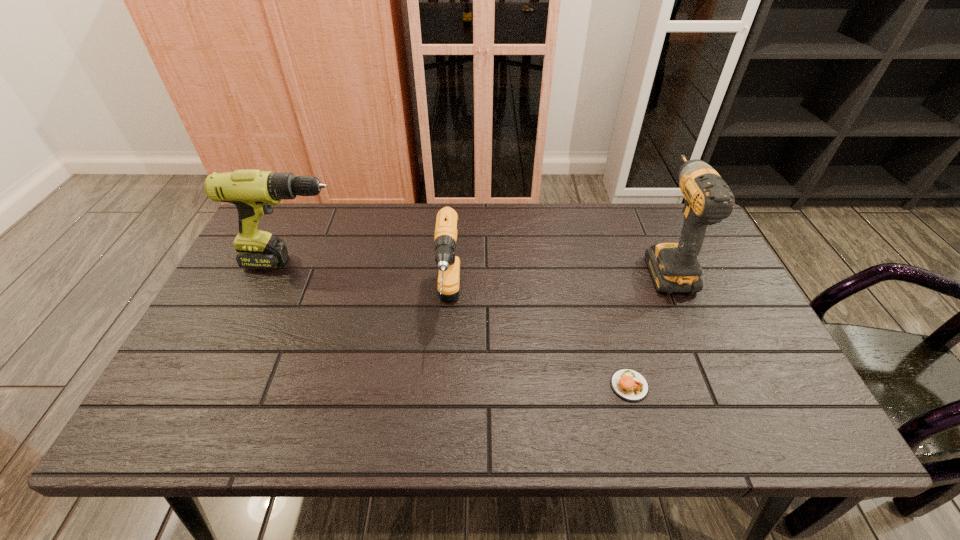
Identify the location of free space between the second object from left to right and the shortest object. The height and width of the screenshot is (540, 960). (539, 345).

The height and width of the screenshot is (540, 960). I want to click on object that stands as the third closest to the leftmost drill, so click(x=674, y=267).

Identify which object is the second nearest to the rightmost object. Please provide its 2D coordinates. Your answer should be formatted as a tuple, i.e. [(x, y)], where the tuple contains the x and y coordinates of a point satisfying the conditions above.

[(445, 236)]

The height and width of the screenshot is (540, 960). Find the location of `drill that stands as the closest to the shortest drill`. drill that stands as the closest to the shortest drill is located at coordinates (253, 192).

Identify the location of the third closest drill to the patty. (253, 192).

At what (x,y) coordinates should I click in order to perform the action: click on free point that satisfies the following two spatial constraints: 1. on the handle side of the leftmost drill; 2. on the left side of the patty. Please return your answer as a coordinate pair (x, y). Image resolution: width=960 pixels, height=540 pixels. Looking at the image, I should click on (243, 386).

Locate an element on the screen. The image size is (960, 540). free spot that satisfies the following two spatial constraints: 1. with the drill bit of the rightmost object facing forward; 2. on the handle side of the leftmost object is located at coordinates (664, 262).

Locate an element on the screen. free space in the image that satisfies the following two spatial constraints: 1. on the handle side of the leftmost drill; 2. on the left side of the third object from left to right is located at coordinates (243, 386).

This screenshot has height=540, width=960. I want to click on vacant region that satisfies the following two spatial constraints: 1. at the tip of the shortest drill; 2. on the right side of the nearest object, so click(444, 386).

Where is `free space in the image that satisfies the following two spatial constraints: 1. at the tip of the third object from left to right; 2. on the right side of the shortest drill`? free space in the image that satisfies the following two spatial constraints: 1. at the tip of the third object from left to right; 2. on the right side of the shortest drill is located at coordinates (444, 386).